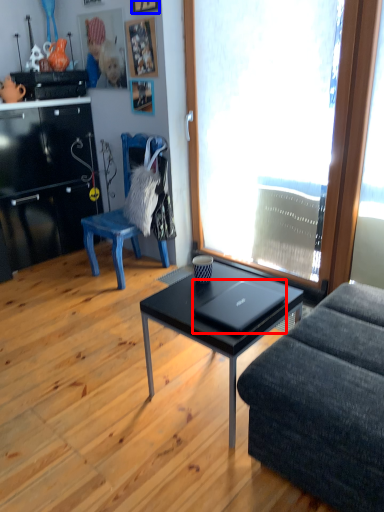
Question: Which point is further to the camera, laptop (highlighted by a red box) or picture frame (highlighted by a blue box)?

Choices:
 (A) laptop
 (B) picture frame

Answer: (B)